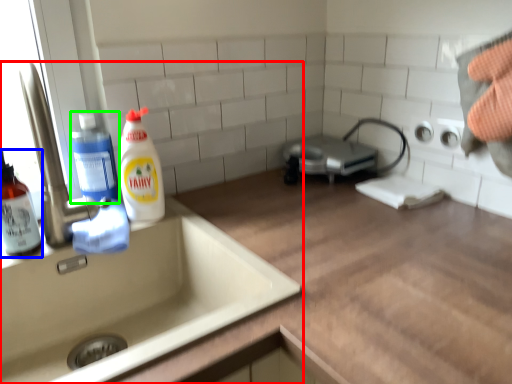
Question: Which is farther away from sink (highlighted by a red box)? cleaning product (highlighted by a blue box) or cleaning product (highlighted by a green box)?

Choices:
 (A) cleaning product
 (B) cleaning product

Answer: (B)